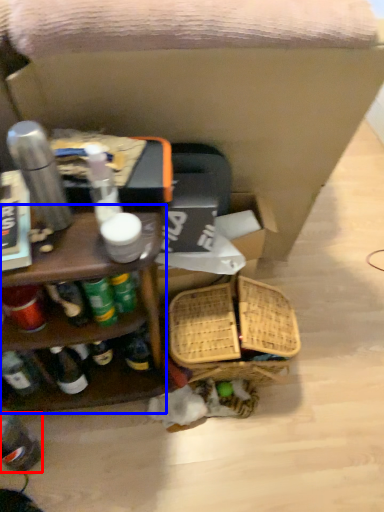
Question: Which of the following is the closest to the observer, bottle (highlighted by a red box) or shelf (highlighted by a blue box)?

Choices:
 (A) bottle
 (B) shelf

Answer: (B)